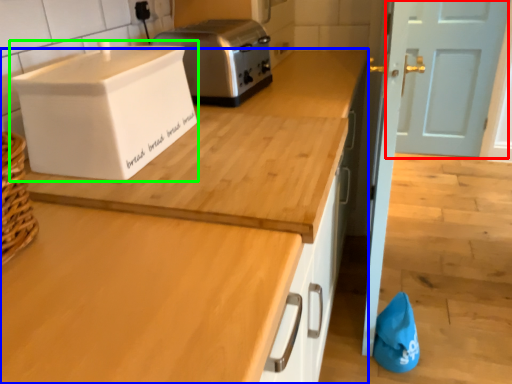
Question: Which object is the farthest from door (highlighted by a red box)? Choose among these: countertop (highlighted by a blue box) or home appliance (highlighted by a green box).

Choices:
 (A) countertop
 (B) home appliance

Answer: (B)